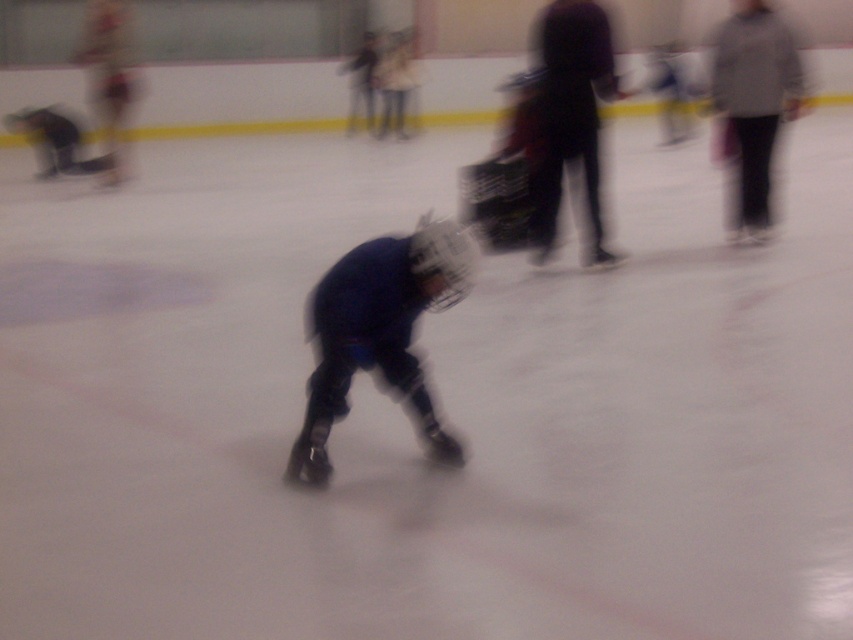
Does blue padded jacket at center have a greater width compared to gray wool sweater at upper right?

Yes.

Does point (323, 413) come in front of point (740, 125)?

Yes, it is in front of point (740, 125).

Does point (306, 476) come farther from viewer compared to point (764, 204)?

No, (306, 476) is in front of (764, 204).

The width and height of the screenshot is (853, 640). Find the location of `blue padded jacket at center`. blue padded jacket at center is located at coordinates (378, 332).